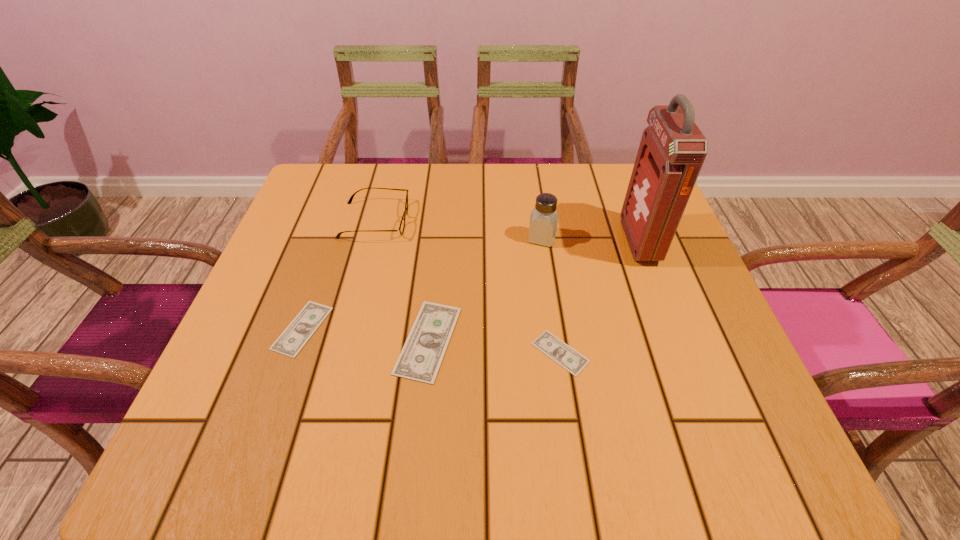
Please show where to add a money on the right while keeping spacing even. Please provide its 2D coordinates. Your answer should be formatted as a tuple, i.e. [(x, y)], where the tuple contains the x and y coordinates of a point satisfying the conditions above.

[(699, 366)]